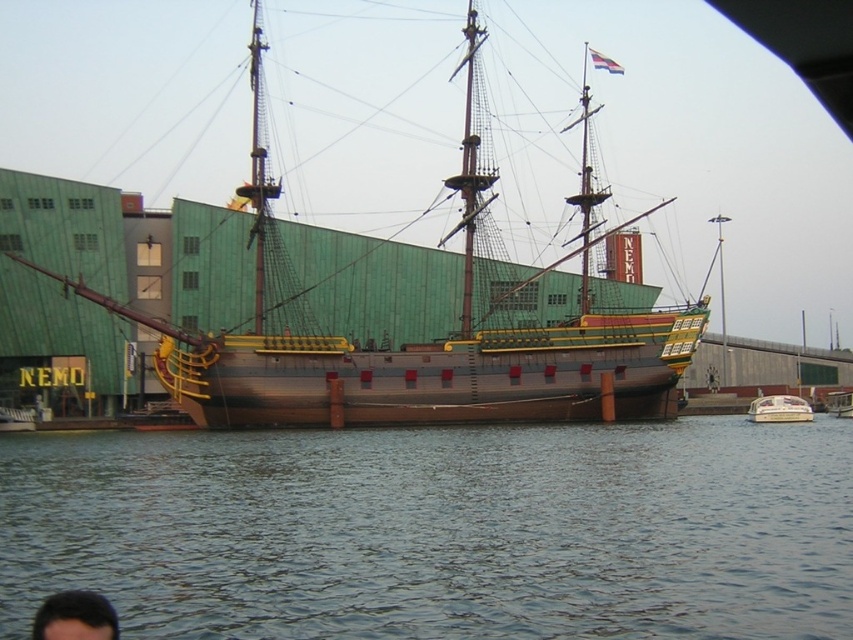
You are standing on the deck of the ship looking towards the modern building. There are two points marked on the deck. Which point is closer to you, point (x=677, y=524) or point (x=39, y=611)?

Point (x=39, y=611) is closer to you because it is nearer to the camera than point (x=677, y=524).

You are standing on the dock next to the historical ship and see the dark blue water at lower center and the white plastic boat at lower right. Which object is closer to you?

The dark blue water at lower center is closer to you because it is in front of the white plastic boat at lower right.